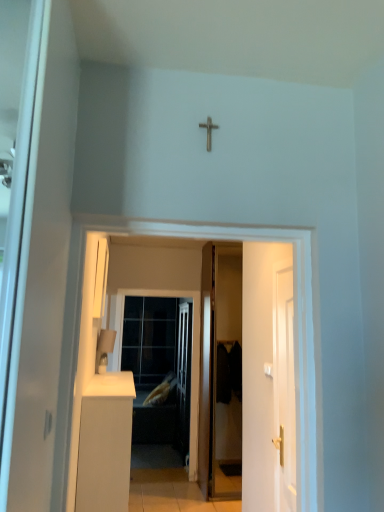
Question: Visually, is white matte cabinet at lower left positioned to the left or to the right of white glossy door at center?

Choices:
 (A) right
 (B) left

Answer: (B)

Question: Looking at their shapes, would you say white matte cabinet at lower left is wider or thinner than white glossy door at center?

Choices:
 (A) thin
 (B) wide

Answer: (B)

Question: Estimate the real-world distances between objects in this image. Which object is closer to the white glossy door at center?

Choices:
 (A) matte white lampshade at lower left
 (B) white glossy door at right, arranged as the second door when viewed from the left
 (C) soft yellow fabric pillow at center
 (D) transparent glass door at center
 (E) wooden door at center, the second door when ordered from front to back

Answer: (B)

Question: Which is nearer to the metallic cross at upper center?

Choices:
 (A) white glossy door at right, which ranks as the first door in right-to-left order
 (B) matte white lampshade at lower left
 (C) soft yellow fabric pillow at center
 (D) white glossy door at center
 (E) white matte cabinet at lower left

Answer: (D)